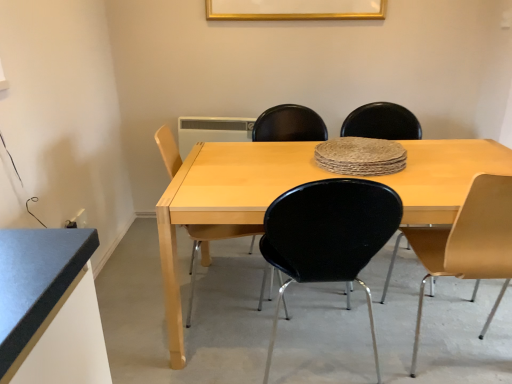
The image size is (512, 384). Identify the location of free area in between matte black chair at center, which is counted as the 3th chair, starting from the left, and matte yellow chair at right, which appears as the 4th chair when viewed from the left. (407, 302).